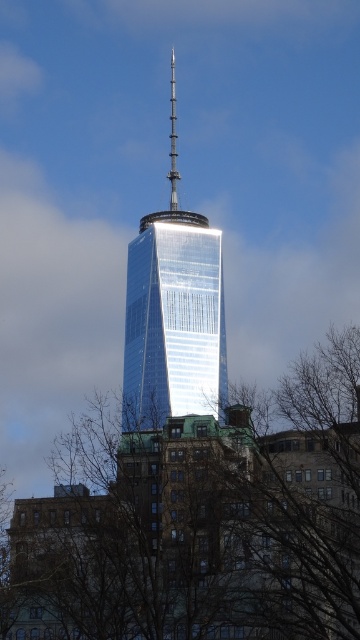
You are standing in front of the skyscraper and want to determine the relative positions of two points marked on the facade. Which point is nearer to you, point (132, 481) or point (172, 172)?

Point (132, 481) is closer to the viewer than point (172, 172).

Consider the image. You are a photographer trying to capture the shiny glass skyscraper at center and the polished silver spire at center in a single frame. Based on their positions, which object should you adjust your camera to focus on first to ensure both are in the frame?

The shiny glass skyscraper at center is to the right of the polished silver spire at center. Therefore, you should focus on the polished silver spire at center first since it is on the left side, allowing you to adjust the frame to include both objects.

You are a photographer aiming to capture the shiny glass skyscraper at center without any obstructions from the brown leafless branches at lower center. Based on their widths, is it possible to adjust your camera angle to avoid the branches?

The brown leafless branches at lower center might be wider than the shiny glass skyscraper at center, so adjusting the camera angle could help avoid the branches if their width allows for a clear shot.